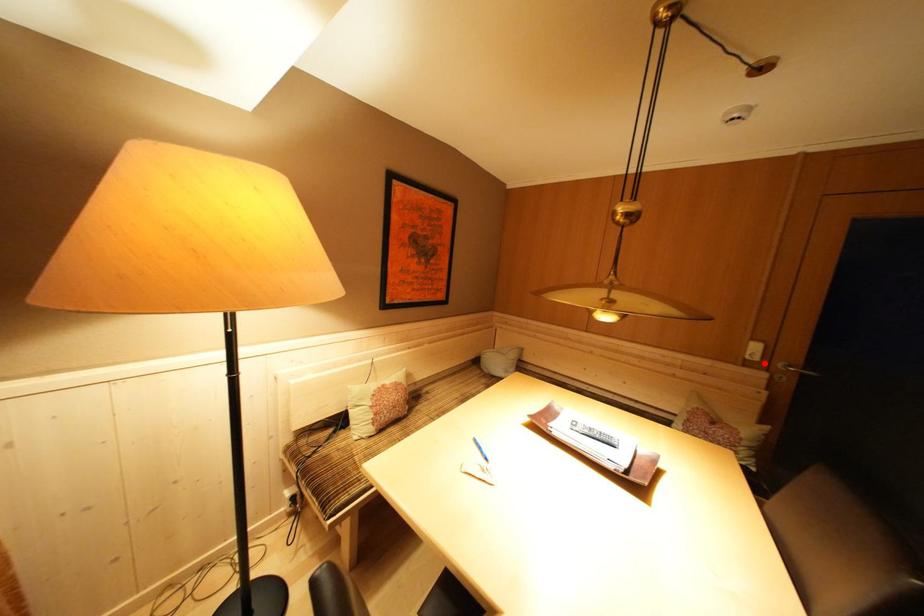
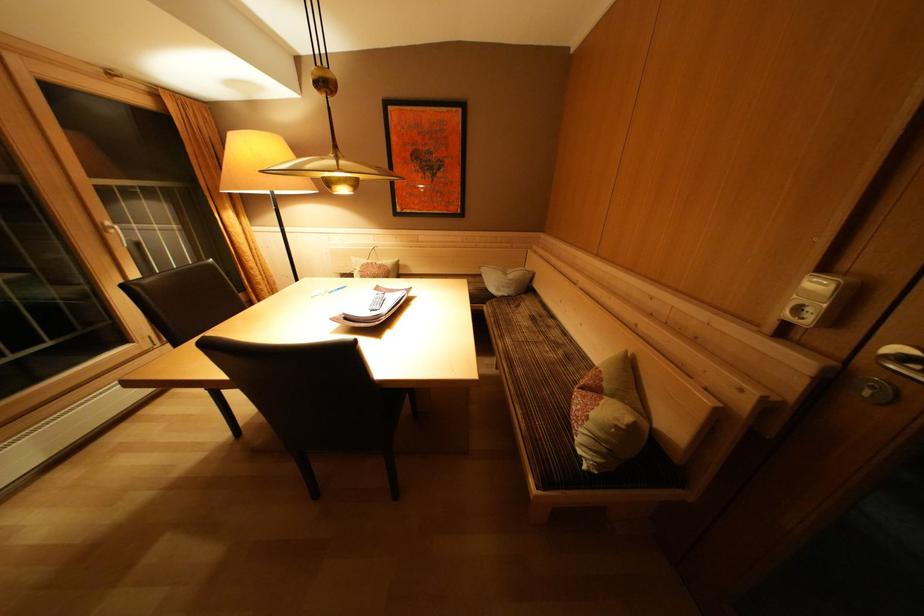
In the second image, find the point that corresponds to the highlighted location in the first image.

(815, 326)